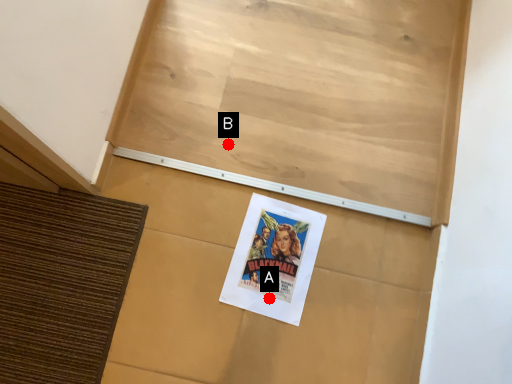
Question: Two points are circled on the image, labeled by A and B beside each circle. Which point is farther from the camera taking this photo?

Choices:
 (A) A is further
 (B) B is further

Answer: (B)